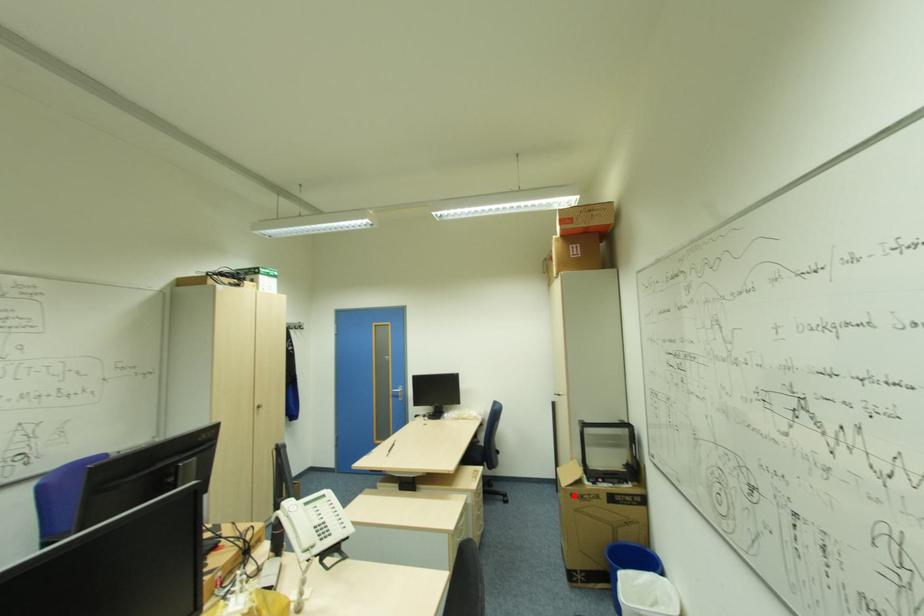
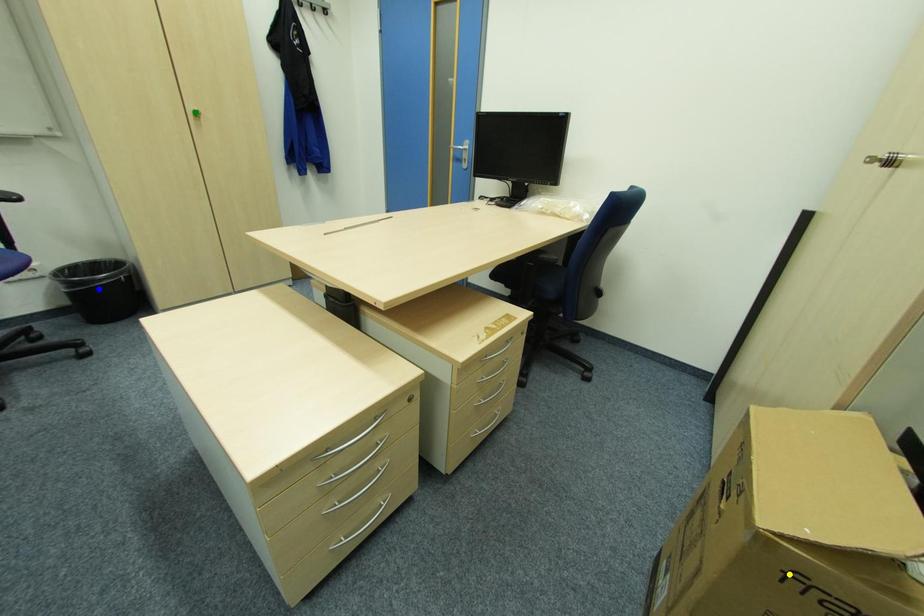
Question: I am providing you with two images of the same scene from different viewpoints. A red point is marked on the first image. You are given multiple points on the second image. Which point in image 2 represents the same 3d spot as the red point in image 1?

Choices:
 (A) yellow point
 (B) blue point
 (C) green point

Answer: (A)